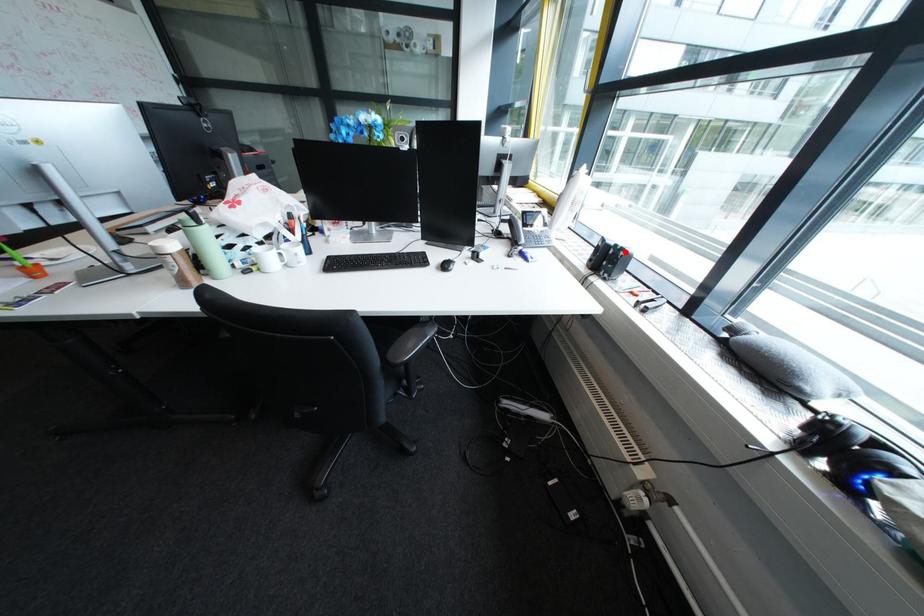
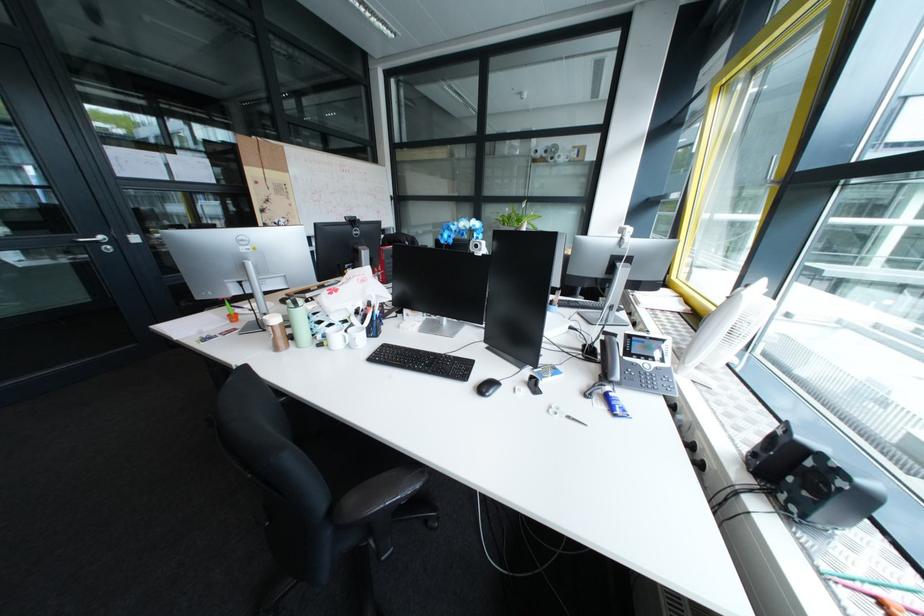
Question: I am providing you with two images of the same scene from different viewpoints. A red point is shown in image1. For the corresponding object point in image2, is it positioned nearer or farther from the camera?

Choices:
 (A) Nearer
 (B) Farther

Answer: (B)